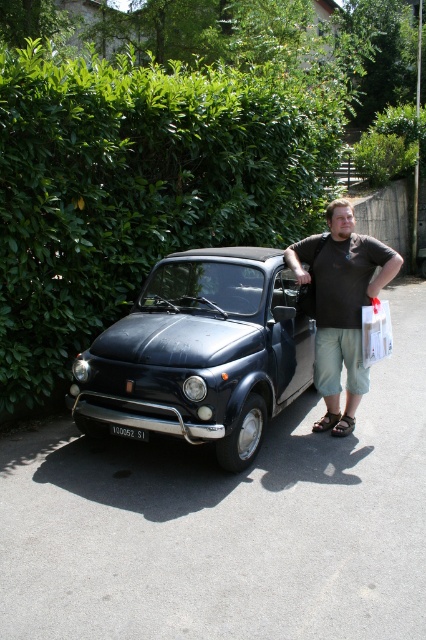
Can you confirm if black rubber car at center is wider than matte black shirt at center?

Yes.

Is black rubber car at center taller than matte black shirt at center?

No.

This screenshot has height=640, width=426. I want to click on black rubber car at center, so click(227, 522).

Is point (52, 192) positioned after point (389, 332)?

Yes, it is behind point (389, 332).

Is green leafy hedge at upper left taller than white paper shopping bag at right?

No, green leafy hedge at upper left is not taller than white paper shopping bag at right.

What do you see at coordinates (138, 188) in the screenshot? The width and height of the screenshot is (426, 640). I see `green leafy hedge at upper left` at bounding box center [138, 188].

This screenshot has height=640, width=426. I want to click on green leafy hedge at upper left, so click(138, 188).

Which is above, matte black shirt at center or white plastic license plate at center?

matte black shirt at center is above.

What do you see at coordinates (340, 307) in the screenshot?
I see `matte black shirt at center` at bounding box center [340, 307].

This screenshot has width=426, height=640. In order to click on matte black shirt at center in this screenshot , I will do `click(340, 307)`.